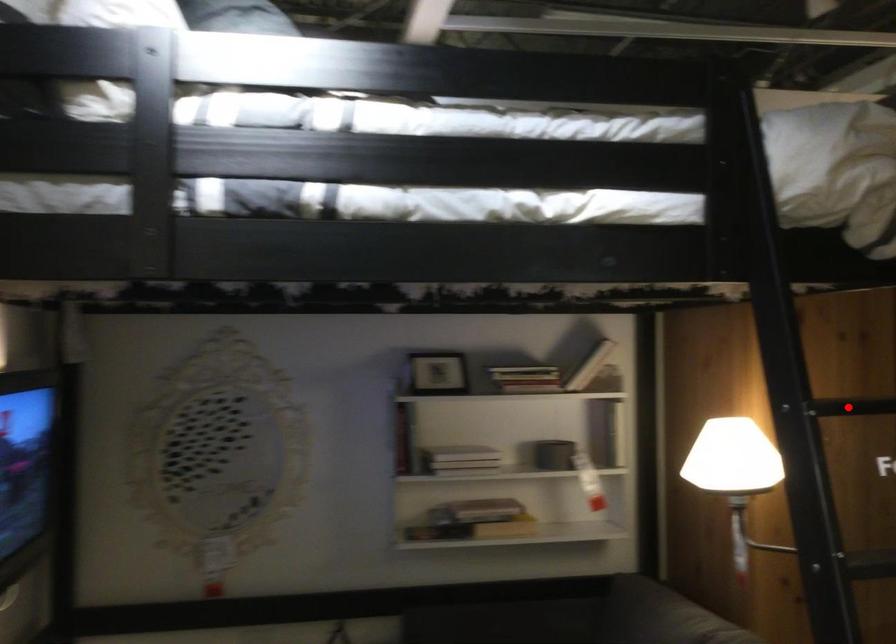
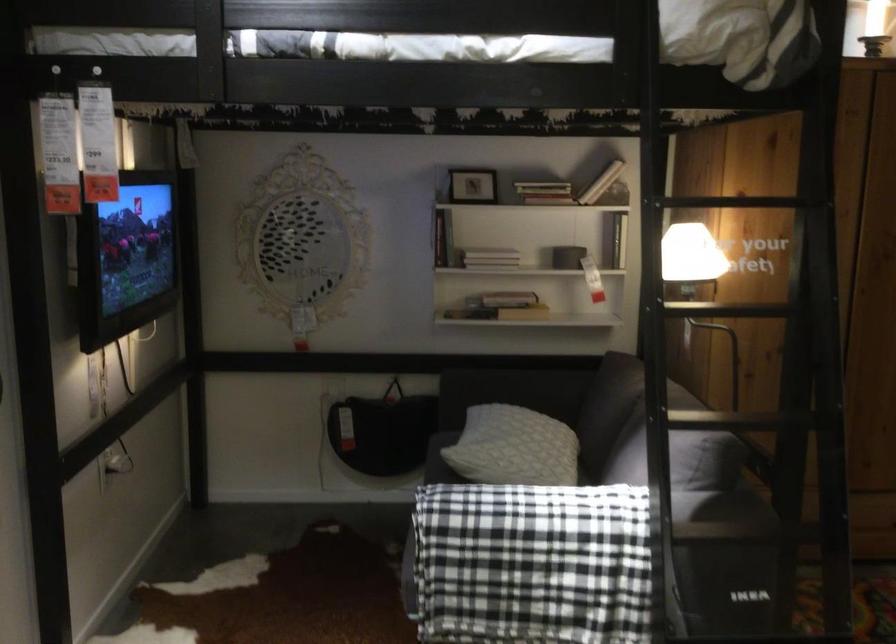
Question: I am providing you with two images of the same scene from different viewpoints. A red point is marked on the first image. Can you still see the location of the red point in image 2?

Choices:
 (A) Yes
 (B) No

Answer: (B)